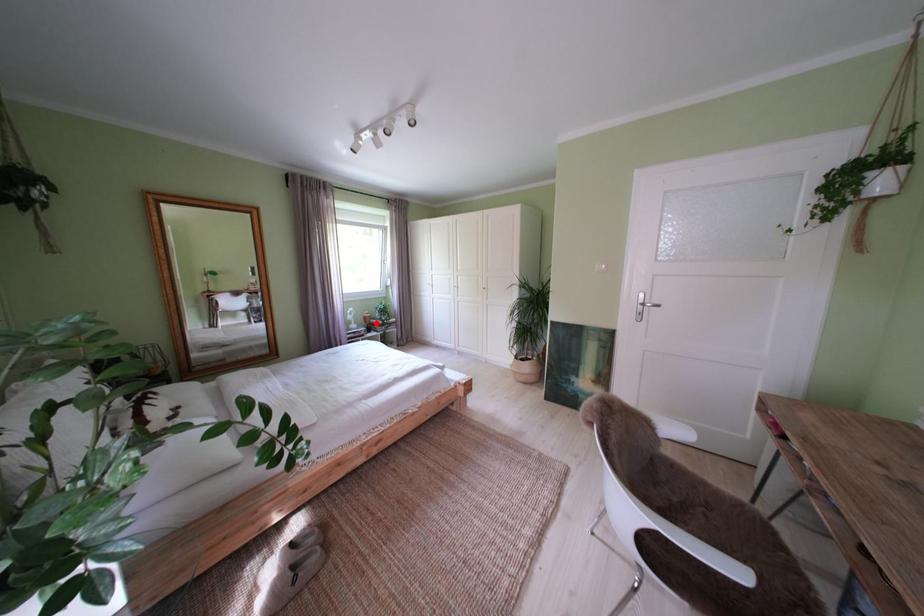
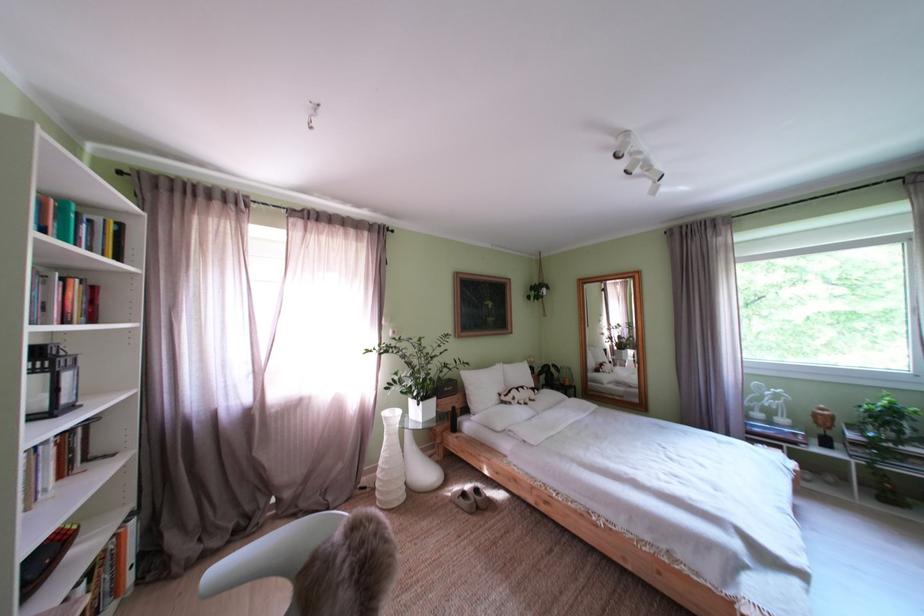
The point at the highlighted location is marked in the first image. Where is the corresponding point in the second image?

(825, 419)